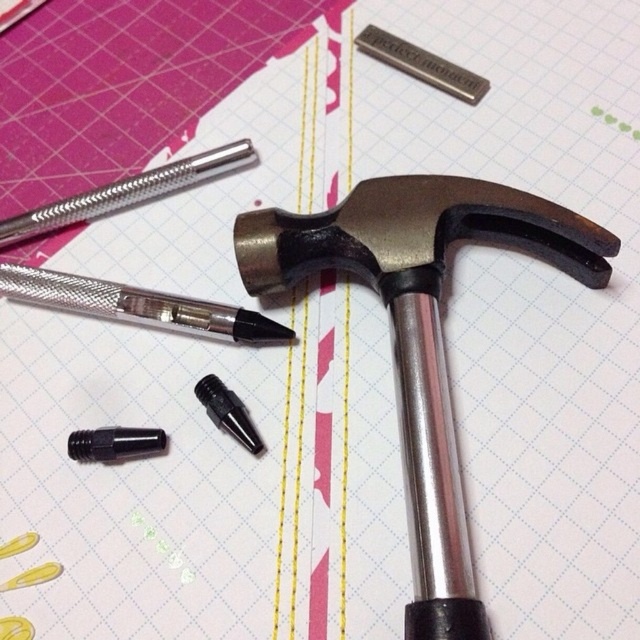
Question: Does metallic silver pen at upper left have a lesser width compared to black plastic screwdriver at lower left?

Choices:
 (A) no
 (B) yes

Answer: (A)

Question: Which object is positioned closest to the metallic textured pen at upper left?

Choices:
 (A) metallic silver pen at upper left
 (B) polished metal hammer at center
 (C) black plastic screwdriver at lower left

Answer: (A)

Question: Which object appears closest to the camera in this image?

Choices:
 (A) black plastic screwdriver at lower left
 (B) metallic silver pen at upper left
 (C) polished metal hammer at center

Answer: (C)

Question: Is polished metal hammer at center above black plastic screwdriver at lower left?

Choices:
 (A) yes
 (B) no

Answer: (A)

Question: Which point appears closest to the camera in this image?

Choices:
 (A) (12, 296)
 (B) (228, 420)
 (C) (196, 164)

Answer: (B)

Question: Is polished metal hammer at center further to the viewer compared to metallic textured pen at upper left?

Choices:
 (A) yes
 (B) no

Answer: (B)